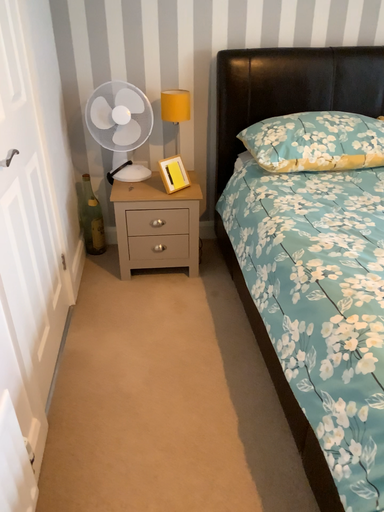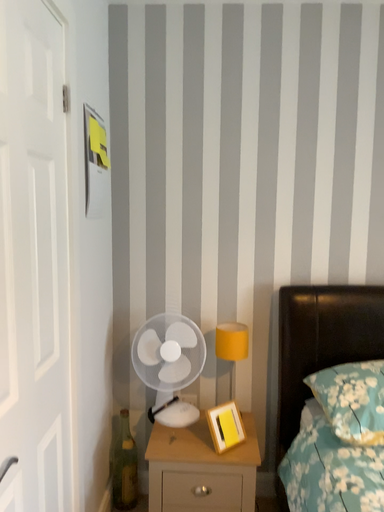
Question: Which way did the camera rotate in the video?

Choices:
 (A) rotated right
 (B) rotated left

Answer: (B)